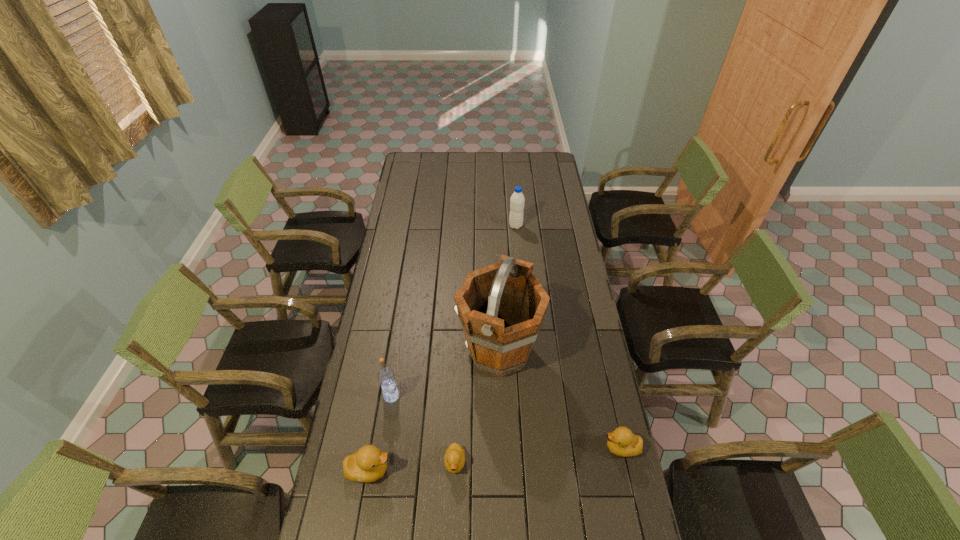
This screenshot has width=960, height=540. What are the coordinates of `blank region between the vodka and the bucket` in the screenshot? It's located at (445, 374).

This screenshot has width=960, height=540. I want to click on free space between the fourth nearest object and the bucket, so click(x=445, y=374).

Image resolution: width=960 pixels, height=540 pixels. Identify the location of blank region between the vodka and the second duckling from right to left. (423, 429).

Identify the location of free space between the third shortest object and the second farthest object. (434, 410).

Where is `object identified as the fourth closest to the rightmost duckling`? This screenshot has height=540, width=960. object identified as the fourth closest to the rightmost duckling is located at coordinates (386, 377).

Find the location of `object that is the nearest to the fourth nearest object`. object that is the nearest to the fourth nearest object is located at coordinates click(x=367, y=464).

Locate an element on the screen. duckling that can be found as the second closest to the vodka is located at coordinates (x=454, y=460).

At what (x,y) coordinates should I click in order to perform the action: click on the closest duckling relative to the shortest object. Please return your answer as a coordinate pair (x, y). Image resolution: width=960 pixels, height=540 pixels. Looking at the image, I should click on [x=367, y=464].

What are the coordinates of `free spot that satisfies the following two spatial constraints: 1. facing forward on the fifth tallest object; 2. facing forward on the shortest object` in the screenshot? It's located at coord(625,462).

This screenshot has height=540, width=960. Identify the location of free spot that satisfies the following two spatial constraints: 1. on the front side of the fifth nearest object; 2. facing forward on the third shortest object. (503, 470).